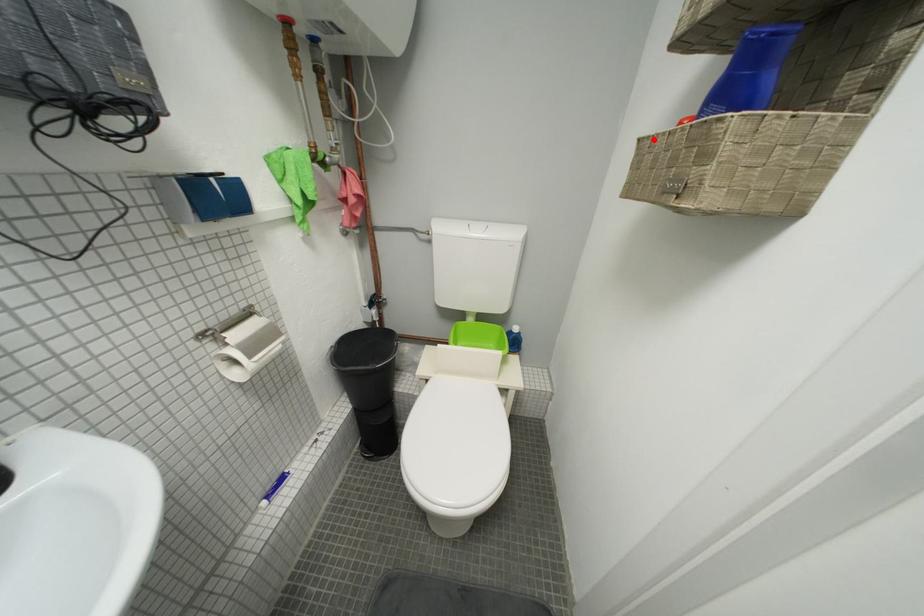
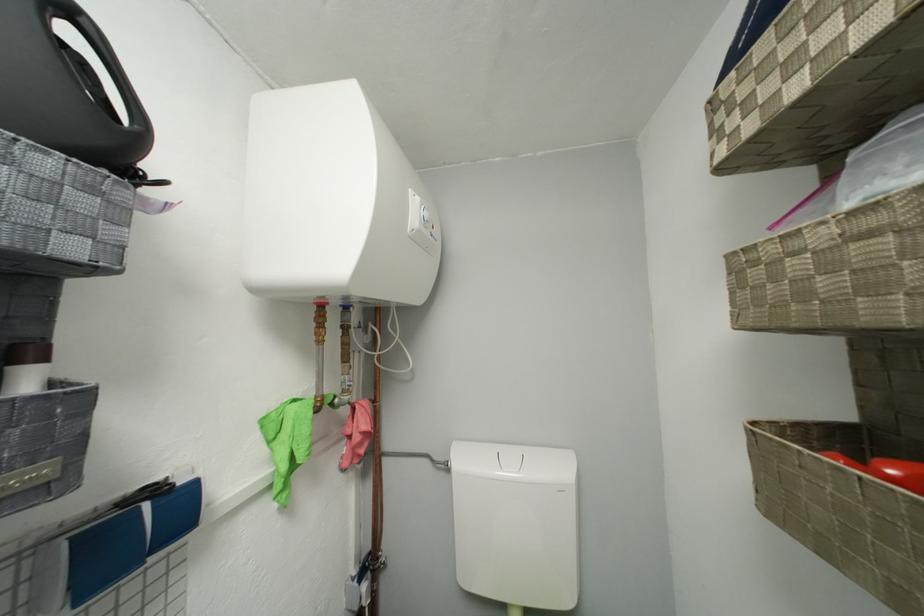
Where in the second image is the point corresponding to the highlighted location from the first image?

(781, 442)